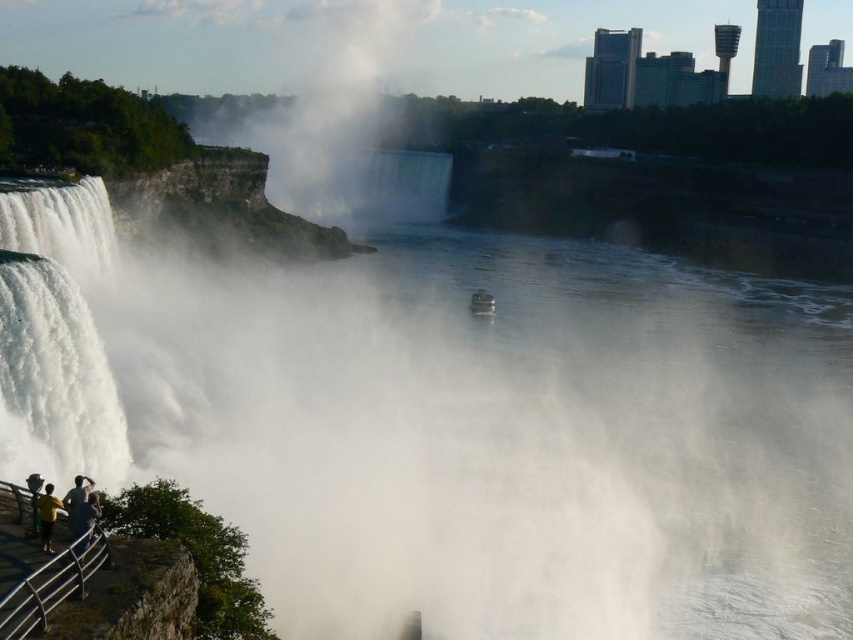
You are standing on the viewing platform and want to take a photo of the metallic gray boat at center without the white misty water at left blocking the view. Which direction should you move to ensure the boat is visible clearly?

You should move to the right side of the viewing platform so that the metallic gray boat at center is positioned to the left of the white misty water at left, ensuring the boat remains visible without obstruction.

You are a photographer planning to capture a wide shot of the Niagara Falls scene. You want to ensure that both the white frothy water at left and the metallic gray boat at center are clearly visible in your photo. Based on their sizes in the image, which object would require more space in the frame to include its entire width?

The white frothy water at left requires more space in the frame because its width is larger than the metallic gray boat at center.